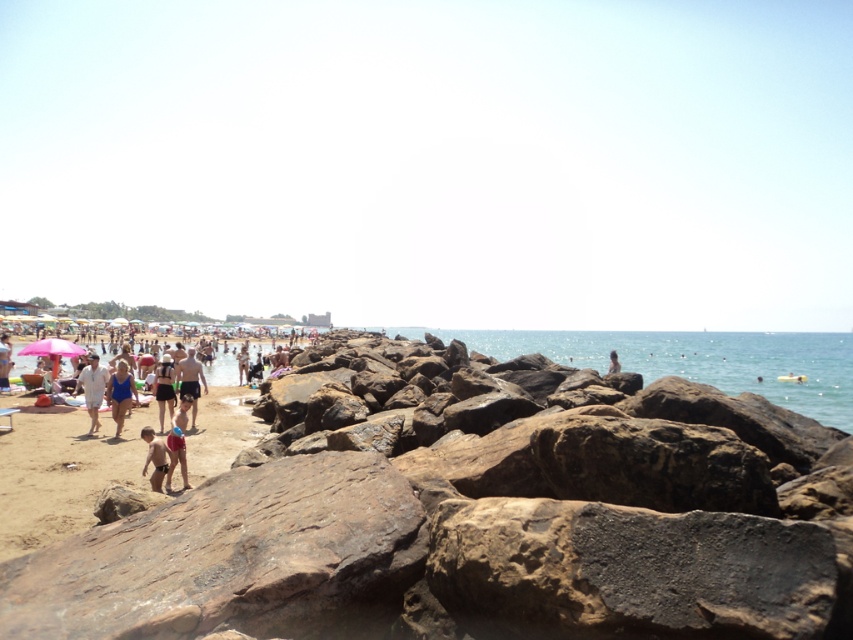
Looking at this image, between white cotton shirt at left and matte black swimsuit at center, which one is positioned higher?

white cotton shirt at left is higher up.

Does white cotton shirt at left have a larger size compared to matte black swimsuit at center?

Yes, white cotton shirt at left is bigger than matte black swimsuit at center.

What do you see at coordinates (93, 388) in the screenshot? I see `white cotton shirt at left` at bounding box center [93, 388].

The height and width of the screenshot is (640, 853). What are the coordinates of `white cotton shirt at left` in the screenshot? It's located at (93, 388).

Between point (78, 378) and point (195, 362), which one is positioned behind?

Point (78, 378)

You are a GUI agent. You are given a task and a screenshot of the screen. Output one action in this format:
    pyautogui.click(x=<x>, y=<y>)
    Task: Click on the white cotton shirt at left
    The height and width of the screenshot is (640, 853).
    Given the screenshot: What is the action you would take?
    pyautogui.click(x=93, y=388)

Between point (93, 426) and point (202, 384), which one is positioned in front?

Positioned in front is point (93, 426).

I want to click on white cotton shirt at left, so click(93, 388).

Consider the image. Does matte pink swimsuit at center appear over matte black swimsuit at center?

No.

Does matte pink swimsuit at center have a smaller size compared to matte black swimsuit at center?

Yes, matte pink swimsuit at center is smaller than matte black swimsuit at center.

Which is in front, point (170, 442) or point (172, 378)?

Positioned in front is point (170, 442).

Where is `matte pink swimsuit at center`? This screenshot has height=640, width=853. matte pink swimsuit at center is located at coordinates (178, 442).